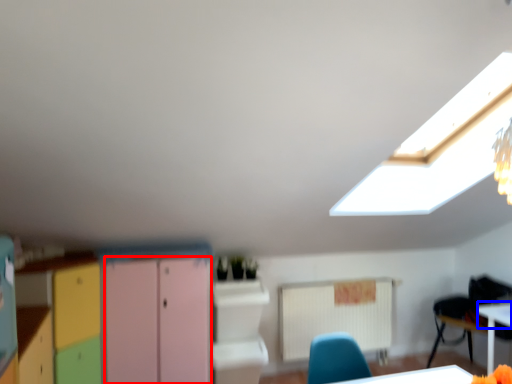
Question: Among these objects, which one is farthest to the camera, file cabinet (highlighted by a red box) or table top (highlighted by a blue box)?

Choices:
 (A) file cabinet
 (B) table top

Answer: (B)